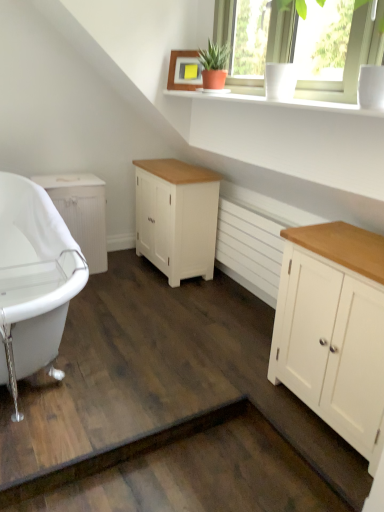
Locate an element on the screen. This screenshot has width=384, height=512. vacant region to the left of white painted wood cabinet at right, the 3th cabinetry viewed from the left is located at coordinates (224, 388).